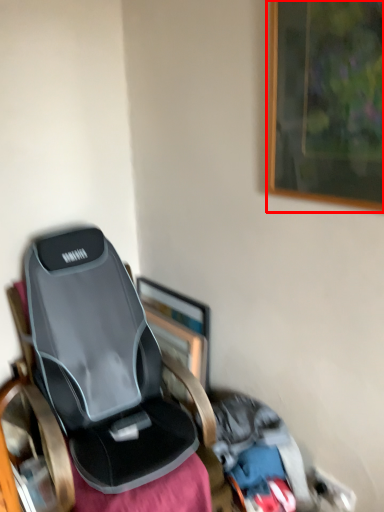
Question: Considering the relative positions of picture frame (annotated by the red box) and picture frame in the image provided, where is picture frame (annotated by the red box) located with respect to the staircase?

Choices:
 (A) left
 (B) right

Answer: (B)